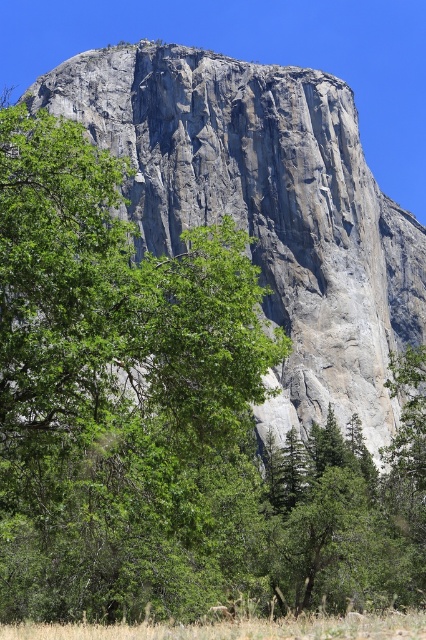
Does gray rock mountain at center have a greater width compared to brown fur at lower center?

Yes.

Is point (336, 273) positioned before point (221, 614)?

No, it is not.

The height and width of the screenshot is (640, 426). Identify the location of gray rock mountain at center. (265, 209).

The width and height of the screenshot is (426, 640). In order to click on gray rock mountain at center in this screenshot , I will do `click(265, 209)`.

Describe the element at coordinates (236, 628) in the screenshot. I see `dry grass at lower center` at that location.

Locate an element on the screen. The height and width of the screenshot is (640, 426). dry grass at lower center is located at coordinates (236, 628).

Which is behind, point (213, 122) or point (290, 616)?

Point (213, 122)

Can you confirm if gray rock mountain at center is smaller than dry grass at lower center?

Incorrect, gray rock mountain at center is not smaller in size than dry grass at lower center.

Between point (161, 188) and point (321, 618), which one is positioned behind?

Point (161, 188)

The height and width of the screenshot is (640, 426). I want to click on gray rock mountain at center, so tap(265, 209).